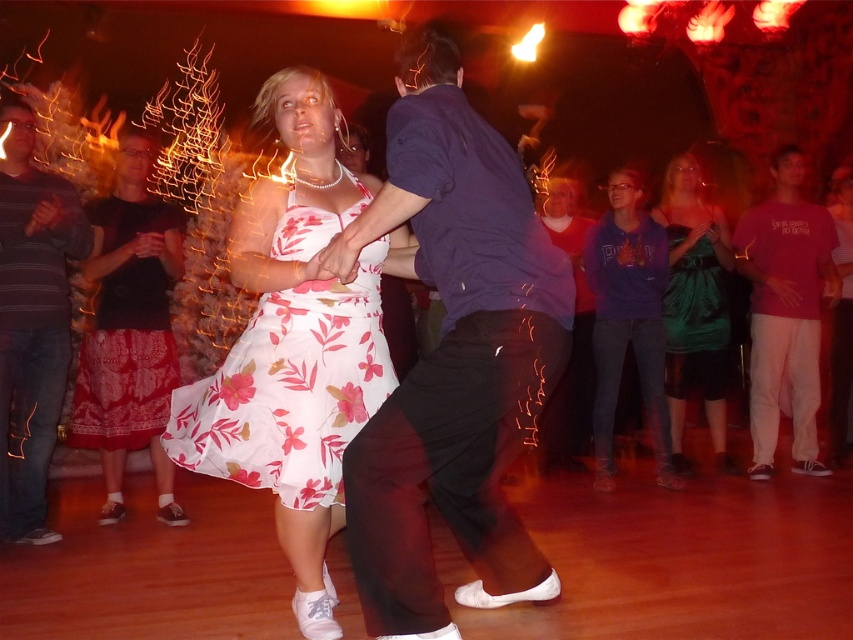
You are at a party and want to take a photo of the two dancers. You are currently standing at point (x=799, y=170). If you move forward to point (x=612, y=420), will you be closer to the dancers?

Yes, because point (x=612, y=420) is in front of point (x=799, y=170), so moving there would bring you closer to the dancers.

You are standing at the center of the dance floor and see a point at coordinates (627, 321). Which object is this point located on?

The point at coordinates (627, 321) is located on the purple hoodie at center.